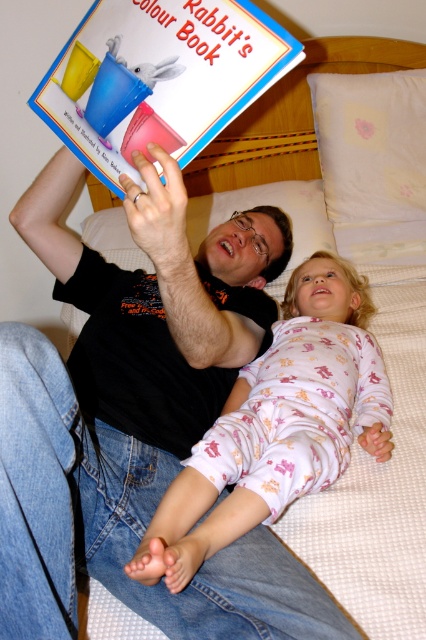
You are a parent trying to place a new toy on the bed. The toy is the size of the white soft pillow at upper right. You want to place it next to the hardcover book at upper center. Is there enough space? Please explain.

The hardcover book at upper center is bigger than the white soft pillow at upper right. Since the toy is the size of the white soft pillow at upper right, there should be enough space to place it next to the hardcover book at upper center as the book itself occupies more space, leaving room for the smaller pillow sized toy.

You are a photographer trying to capture a closeup of the hardcover book at upper center and the white soft pillow at upper right. Since you want both items in focus, you need to know their positions relative to each other. Which object is positioned to the left of the other?

The hardcover book at upper center is to the left of white soft pillow at upper right.

You are a photographer trying to capture a closeup of the white cotton pajamas at center. Based on their position in the image, can you confirm if they are positioned in the lower half of the frame?

The white cotton pajamas at center is located at point (276, 426), which falls within the lower half of the frame since the y coordinate is above 0.5.